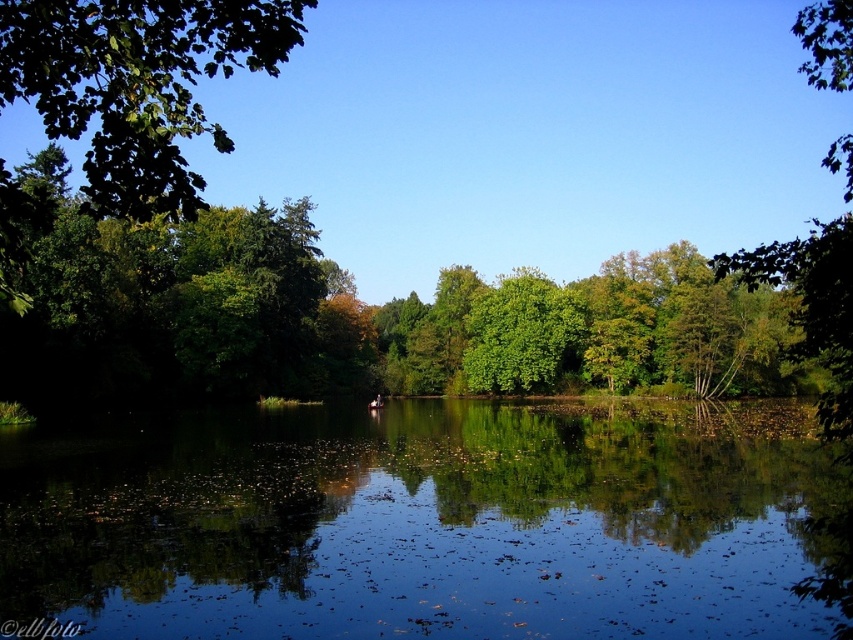
Question: Observing the image, what is the correct spatial positioning of green reflective water at center in reference to green leafy tree at center?

Choices:
 (A) above
 (B) below

Answer: (B)

Question: Does green reflective water at center lie behind green leafy tree at center?

Choices:
 (A) no
 (B) yes

Answer: (A)

Question: Which object is positioned farthest from the green reflective water at center?

Choices:
 (A) green leafy tree at upper left
 (B) green leafy tree at center

Answer: (B)

Question: Which object appears farthest from the camera in this image?

Choices:
 (A) green leafy tree at upper left
 (B) green reflective water at center

Answer: (A)

Question: Which point is farther from the camera taking this photo?

Choices:
 (A) (219, 248)
 (B) (718, 483)

Answer: (A)

Question: Can you confirm if green reflective water at center is positioned above green leafy tree at right?

Choices:
 (A) no
 (B) yes

Answer: (A)